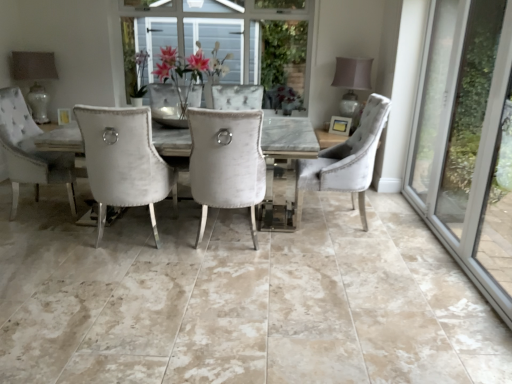
Where is `free region under velvet grey chair at right, which ranks as the first chair in right-to-left order (from a real-world perspective)`? free region under velvet grey chair at right, which ranks as the first chair in right-to-left order (from a real-world perspective) is located at coordinates (331, 217).